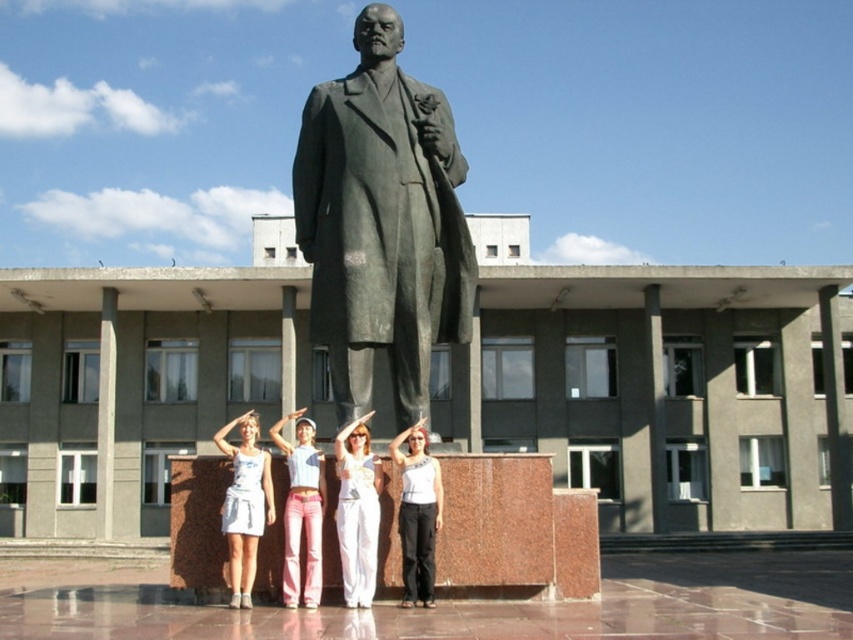
Question: Is bronze statue at center to the right of pink denim jeans at center from the viewer's perspective?

Choices:
 (A) no
 (B) yes

Answer: (B)

Question: Estimate the real-world distances between objects in this image. Which object is closer to the white tank top at center?

Choices:
 (A) white cotton tank top at center
 (B) white cotton pants at center
 (C) pink denim jeans at center
 (D) bronze statue at center

Answer: (B)

Question: From the image, what is the correct spatial relationship of white cotton pants at center in relation to white cotton tank top at center?

Choices:
 (A) above
 (B) below

Answer: (A)

Question: Does white cotton pants at center appear on the left side of white tank top at center?

Choices:
 (A) no
 (B) yes

Answer: (B)

Question: Which object is positioned farthest from the white cotton pants at center?

Choices:
 (A) bronze statue at center
 (B) white cotton tank top at center
 (C) pink denim jeans at center
 (D) white tank top at center

Answer: (A)

Question: Which point is closer to the camera taking this photo?

Choices:
 (A) (345, 481)
 (B) (289, 465)
 (C) (360, 253)

Answer: (A)